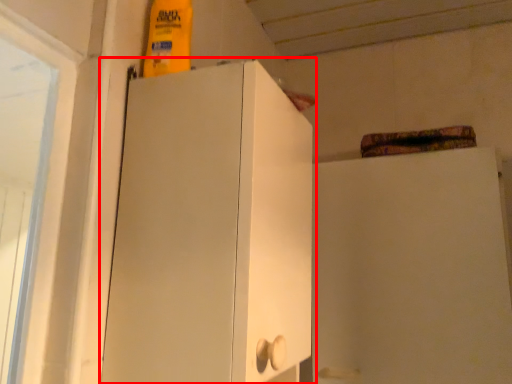
Question: In this image, where is cupboard (annotated by the red box) located relative to cabinetry?

Choices:
 (A) left
 (B) right

Answer: (A)